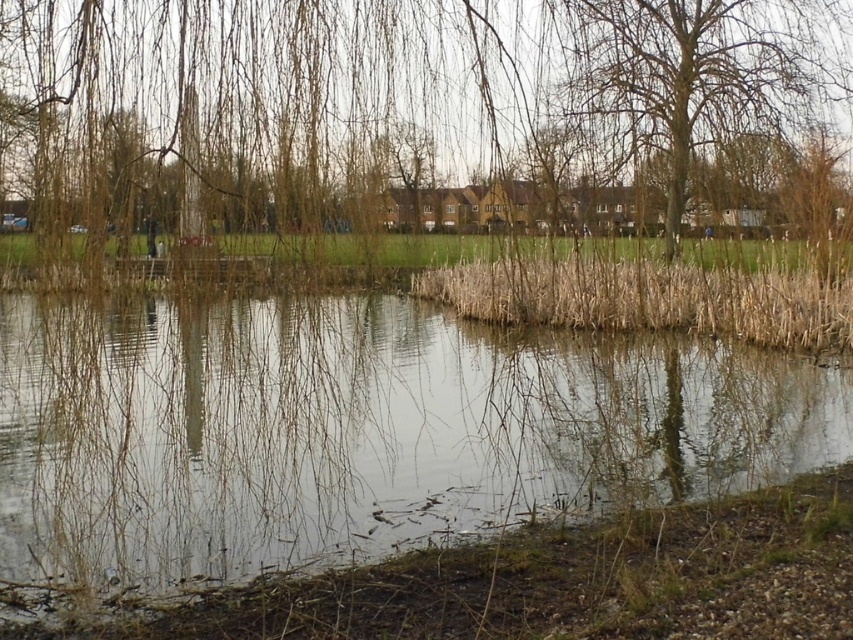
Between brown leafless branches at upper center and dry grass at center, which one appears on the left side from the viewer's perspective?

Positioned to the left is brown leafless branches at upper center.

Is the position of brown leafless branches at upper center more distant than that of dry grass at center?

That is False.

Which is behind, point (265, 88) or point (722, 300)?

Point (722, 300)

The height and width of the screenshot is (640, 853). I want to click on brown leafless branches at upper center, so (x=381, y=100).

Does clear water at center have a greater width compared to dry grass at center?

No, clear water at center is not wider than dry grass at center.

In the scene shown: Is clear water at center in front of dry grass at center?

Yes, it is.

Between point (68, 502) and point (844, 317), which one is positioned in front?

Point (68, 502) is more forward.

The height and width of the screenshot is (640, 853). What are the coordinates of `clear water at center` in the screenshot? It's located at (360, 429).

Is clear water at center positioned in front of brown leafless branches at upper center?

Yes.

Describe the element at coordinates (360, 429) in the screenshot. I see `clear water at center` at that location.

Who is more forward, (508, 358) or (848, 81)?

Point (508, 358)

At what (x,y) coordinates should I click in order to perform the action: click on clear water at center. Please return your answer as a coordinate pair (x, y). Looking at the image, I should click on (360, 429).